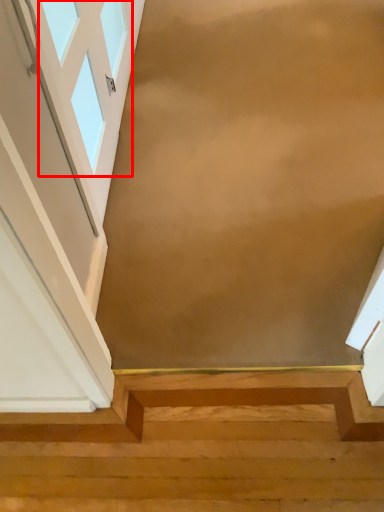
Question: From the image, what is the correct spatial relationship of window (annotated by the red box) in relation to stairs?

Choices:
 (A) left
 (B) right

Answer: (A)